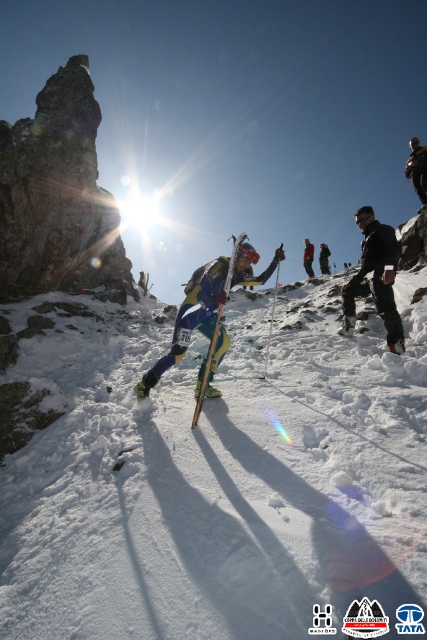
Is yellow-green ski suit at center shorter than yellow matte ski at center?

No.

Who is positioned more to the right, yellow-green ski suit at center or yellow matte ski at center?

Positioned to the right is yellow matte ski at center.

What do you see at coordinates (190, 317) in the screenshot?
I see `yellow-green ski suit at center` at bounding box center [190, 317].

Find the location of `yellow-green ski suit at center`. yellow-green ski suit at center is located at coordinates (190, 317).

Can you confirm if yellow fabric jacket at upper center is bigger than blue fabric jacket at center?

Correct, yellow fabric jacket at upper center is larger in size than blue fabric jacket at center.

Does yellow fabric jacket at upper center have a smaller size compared to blue fabric jacket at center?

Actually, yellow fabric jacket at upper center might be larger than blue fabric jacket at center.

Who is more distant from viewer, (x=414, y=177) or (x=309, y=260)?

Positioned behind is point (x=309, y=260).

The height and width of the screenshot is (640, 427). Identify the location of yellow fabric jacket at upper center. (418, 168).

Can you confirm if white powdery snow at center is thinner than blue fabric jacket at center?

Indeed, white powdery snow at center has a lesser width compared to blue fabric jacket at center.

Is white powdery snow at center positioned at the back of blue fabric jacket at center?

No, it is in front of blue fabric jacket at center.

Is point (362, 492) farther from camera compared to point (310, 260)?

No.

At what (x,y) coordinates should I click in order to perform the action: click on white powdery snow at center. Please return your answer as a coordinate pair (x, y). Looking at the image, I should click on (210, 470).